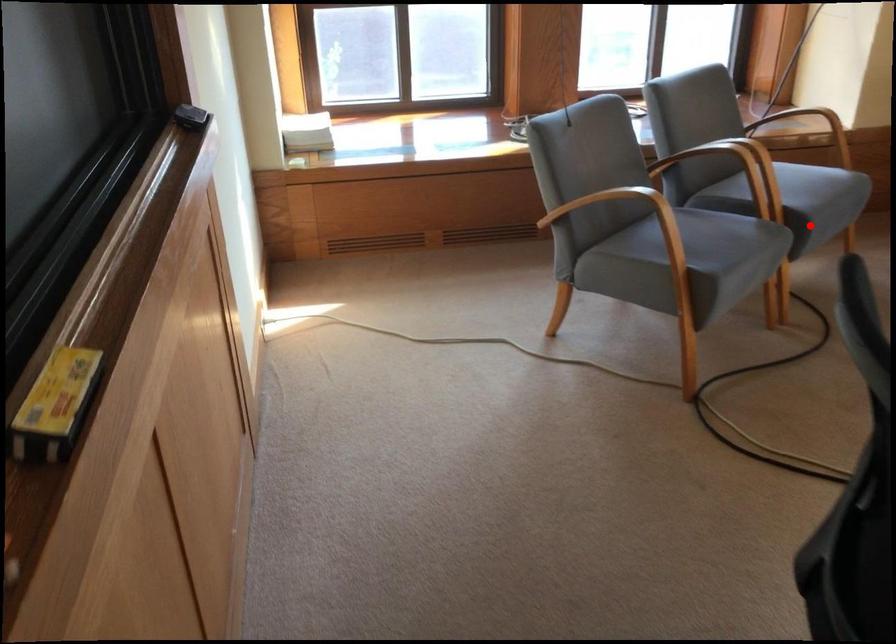
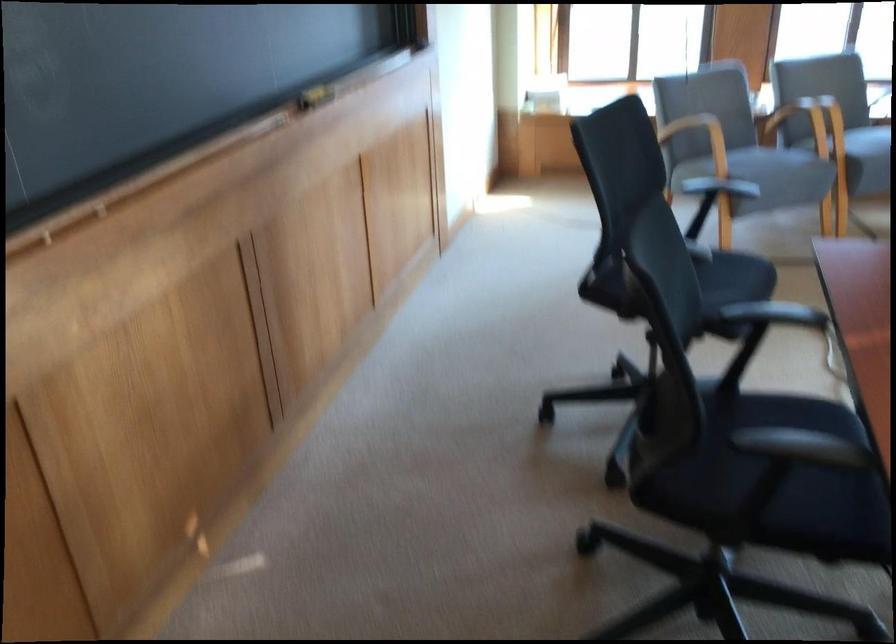
Locate, in the second image, the point that corresponds to the highlighted location in the first image.

(859, 152)